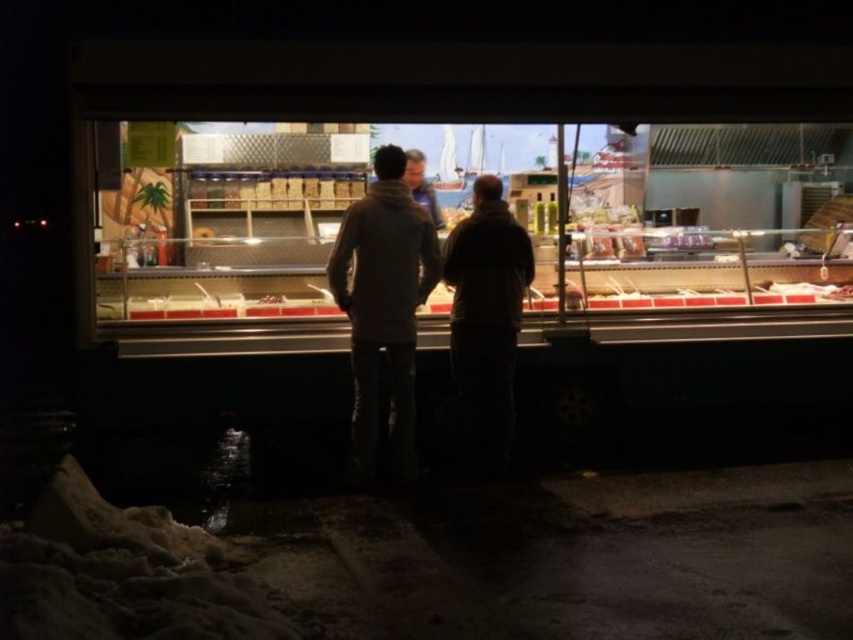
Can you confirm if dark brown leather jacket at center is thinner than smooth beige jacket at center?

Incorrect, dark brown leather jacket at center's width is not less than smooth beige jacket at center's.

Between point (462, 358) and point (416, 154), which one is positioned in front?

Point (462, 358)

Where is `dark brown leather jacket at center`? dark brown leather jacket at center is located at coordinates (485, 324).

Between dark gray hoodie at center and dark brown leather jacket at center, which one is positioned lower?

Positioned lower is dark brown leather jacket at center.

Between dark gray hoodie at center and dark brown leather jacket at center, which one appears on the left side from the viewer's perspective?

dark gray hoodie at center

Is point (498, 196) farther from camera compared to point (515, 291)?

Yes, it is.

Locate an element on the screen. dark gray hoodie at center is located at coordinates (386, 307).

Is transparent glass display case at center to the left of dark brown leather jacket at center from the viewer's perspective?

No, transparent glass display case at center is not to the left of dark brown leather jacket at center.

From the picture: Between transparent glass display case at center and dark brown leather jacket at center, which one has more height?

dark brown leather jacket at center

Who is more distant from viewer, (817, 289) or (476, 212)?

Point (817, 289)

Locate an element on the screen. transparent glass display case at center is located at coordinates (469, 208).